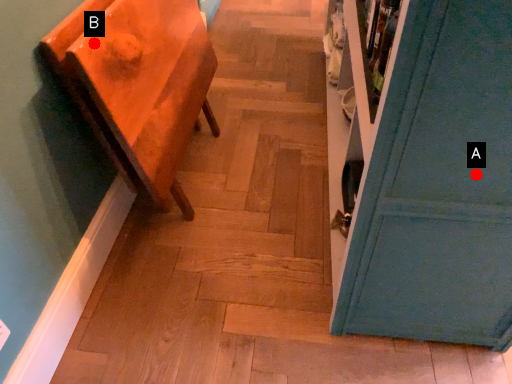
Question: Two points are circled on the image, labeled by A and B beside each circle. Which point is farther from the camera taking this photo?

Choices:
 (A) A is further
 (B) B is further

Answer: (B)